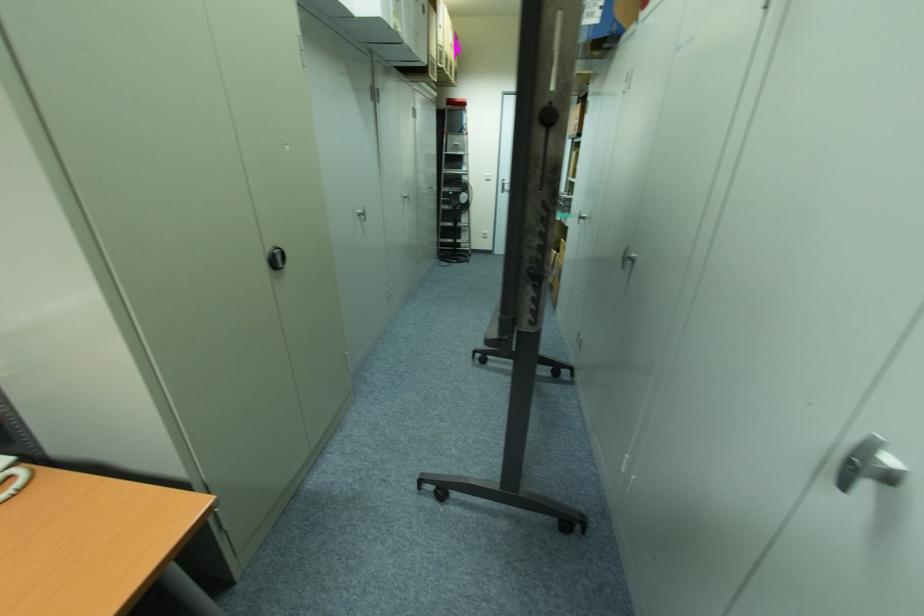
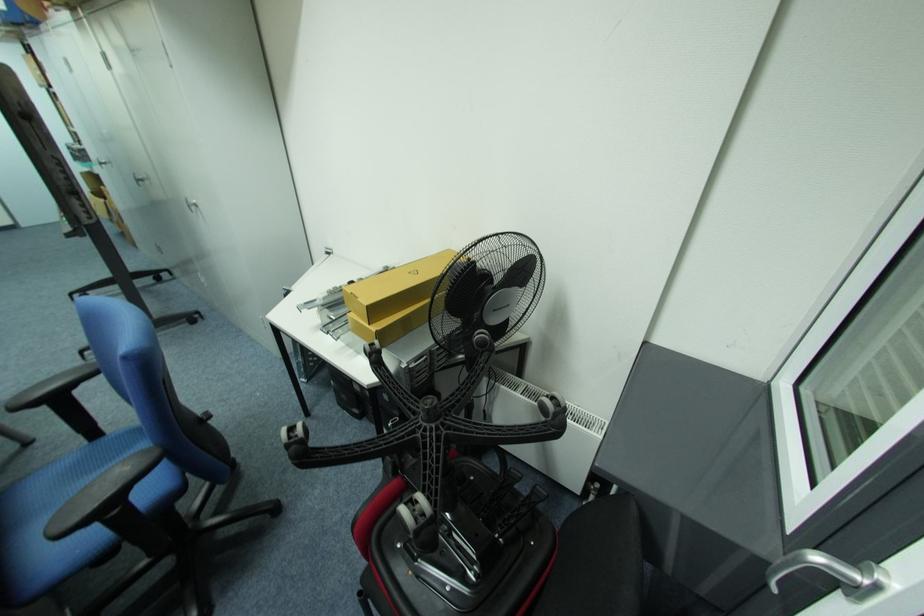
Question: I am providing you with two images of the same scene from different viewpoints. After the viewpoint changes to image2, which objects are now occluded?

Choices:
 (A) black chair armrest
 (B) black chair wheel
 (C) metal locker handle
 (D) none of these

Answer: (D)